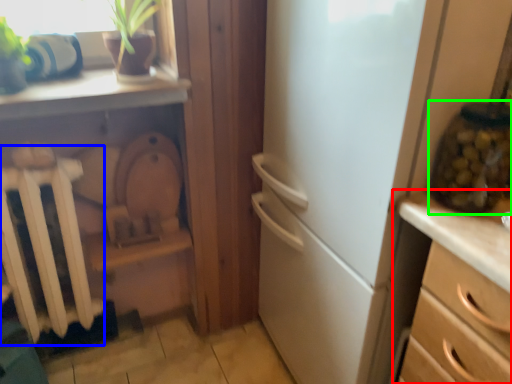
Question: Which object is the closest to the chest of drawers (highlighted by a red box)? Choose among these: radiator (highlighted by a blue box) or glass jar (highlighted by a green box).

Choices:
 (A) radiator
 (B) glass jar

Answer: (B)